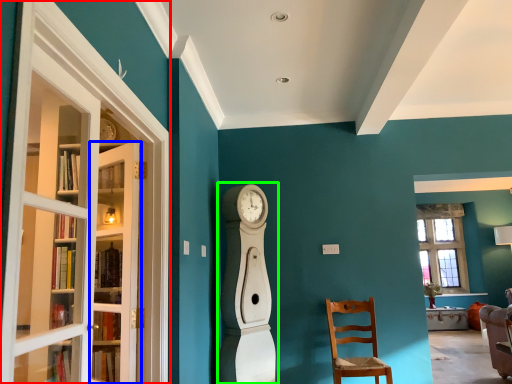
Question: Based on their relative distances, which object is nearer to screen door (highlighted by a red box)? Choose from door (highlighted by a blue box) and open (highlighted by a green box).

Choices:
 (A) door
 (B) open

Answer: (A)